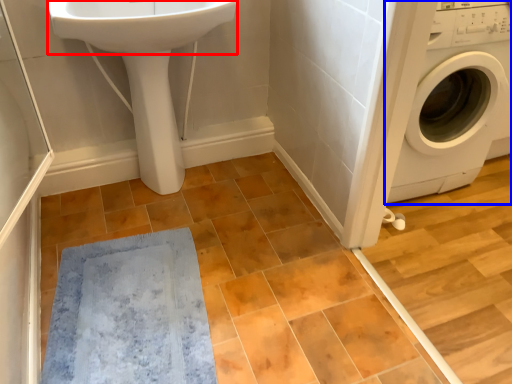
Question: Which object appears closest to the camera in this image, sink (highlighted by a red box) or washing machine (highlighted by a blue box)?

Choices:
 (A) sink
 (B) washing machine

Answer: (A)